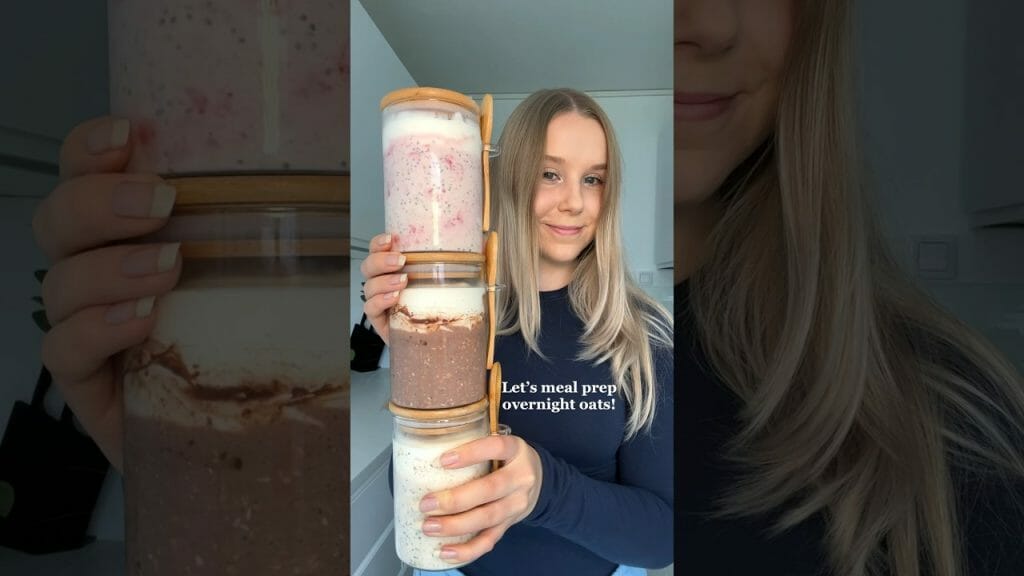
I want to click on clear glass jars stacked in girl's hands, so click(x=400, y=435), click(x=423, y=278), click(x=425, y=115).